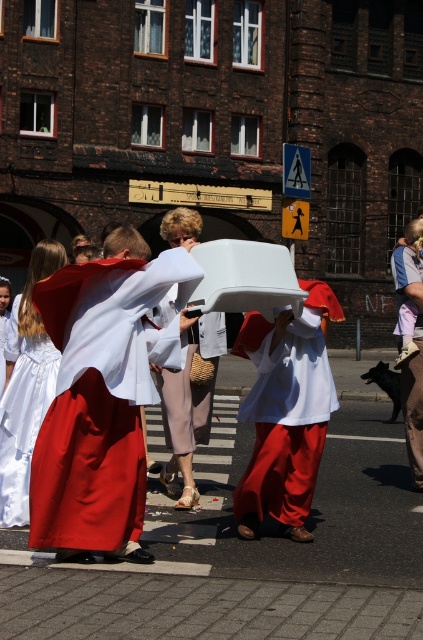
Between matte white cape at center and white satin dress at lower left, which one has less height?

With less height is matte white cape at center.

Does matte white cape at center have a greater height compared to white satin dress at lower left?

No.

Between point (304, 380) and point (8, 385), which one is positioned in front?

Point (304, 380) is in front.

You are a GUI agent. You are given a task and a screenshot of the screen. Output one action in this format:
    pyautogui.click(x=<x>, y=<y>)
    Task: Click on the matte white cape at center
    Image resolution: width=423 pixels, height=640 pixels.
    Given the screenshot: What is the action you would take?
    pyautogui.click(x=285, y=412)

Between matte white cape at center and light beige fabric pants at center, which one appears on the right side from the viewer's perspective?

From the viewer's perspective, matte white cape at center appears more on the right side.

Between matte white cape at center and light beige fabric pants at center, which one has more height?

With more height is light beige fabric pants at center.

At what (x,y) coordinates should I click in order to perform the action: click on matte white cape at center. Please return your answer as a coordinate pair (x, y). The width and height of the screenshot is (423, 640). Looking at the image, I should click on (285, 412).

This screenshot has width=423, height=640. In order to click on matte white cape at center in this screenshot , I will do `click(285, 412)`.

Is the position of matte white cape at center more distant than that of light pink fabric dress at lower right?

No, it is in front of light pink fabric dress at lower right.

Does point (264, 406) come closer to viewer compared to point (412, 380)?

Yes, point (264, 406) is in front of point (412, 380).

Which is in front, point (238, 417) or point (420, 353)?

Point (238, 417)

Where is `matte white cape at center`? This screenshot has width=423, height=640. matte white cape at center is located at coordinates (285, 412).